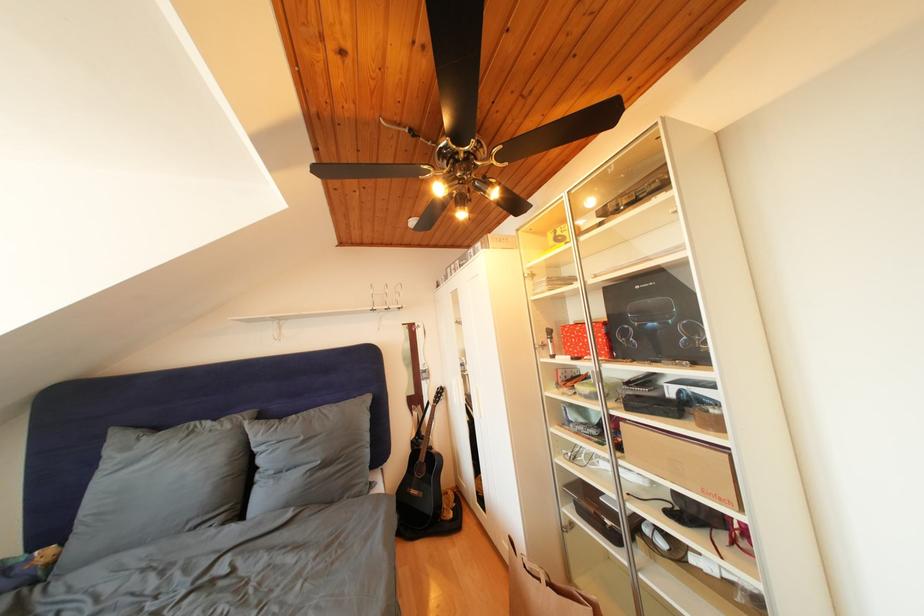
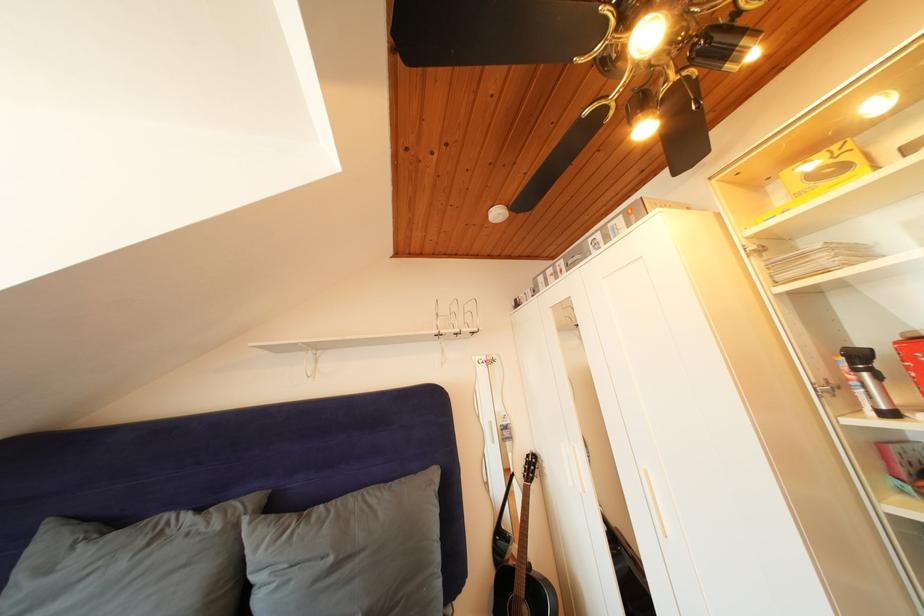
Locate, in the second image, the point that corresponds to pixel 431 462 in the first image.

(528, 592)